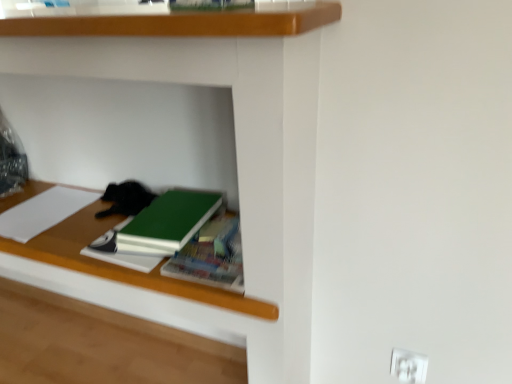
Where is `free space above green matte book at center, which is the first book from right to left (from a real-world perspective)`? This screenshot has width=512, height=384. free space above green matte book at center, which is the first book from right to left (from a real-world perspective) is located at coordinates (212, 248).